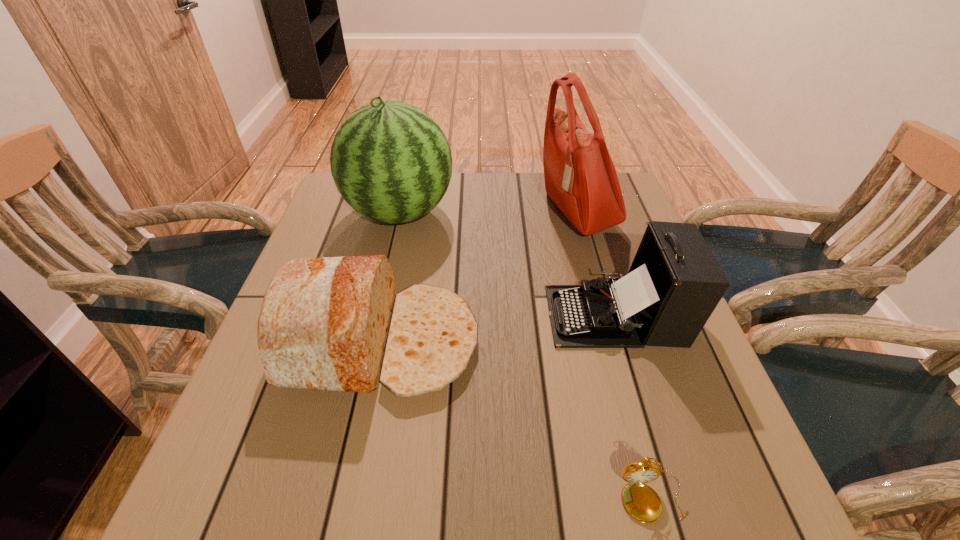
The width and height of the screenshot is (960, 540). What are the coordinates of `handbag` in the screenshot? It's located at (580, 177).

I want to click on watermelon, so pos(391,162).

You are a GUI agent. You are given a task and a screenshot of the screen. Output one action in this format:
    pyautogui.click(x=<x>, y=<y>)
    Task: Click on the typewriter
    This screenshot has height=540, width=960.
    Given the screenshot: What is the action you would take?
    pyautogui.click(x=674, y=284)

Identify the location of bread. Image resolution: width=960 pixels, height=540 pixels. (334, 323).

Identify the location of pocket watch. (641, 501).

Where is `the shortest object`? The image size is (960, 540). the shortest object is located at coordinates (641, 501).

The height and width of the screenshot is (540, 960). I want to click on vacant region located 0.300m on the front-facing side of the handbag, so pyautogui.click(x=434, y=212).

The width and height of the screenshot is (960, 540). I want to click on vacant area situated 0.070m on the front-facing side of the handbag, so click(515, 212).

Locate an element on the screen. vacant space located on the front-facing side of the handbag is located at coordinates (431, 212).

At what (x,y) coordinates should I click in order to perform the action: click on free location located 0.110m on the front of the watermelon. Please return your answer as a coordinate pair (x, y). Looking at the image, I should click on (385, 277).